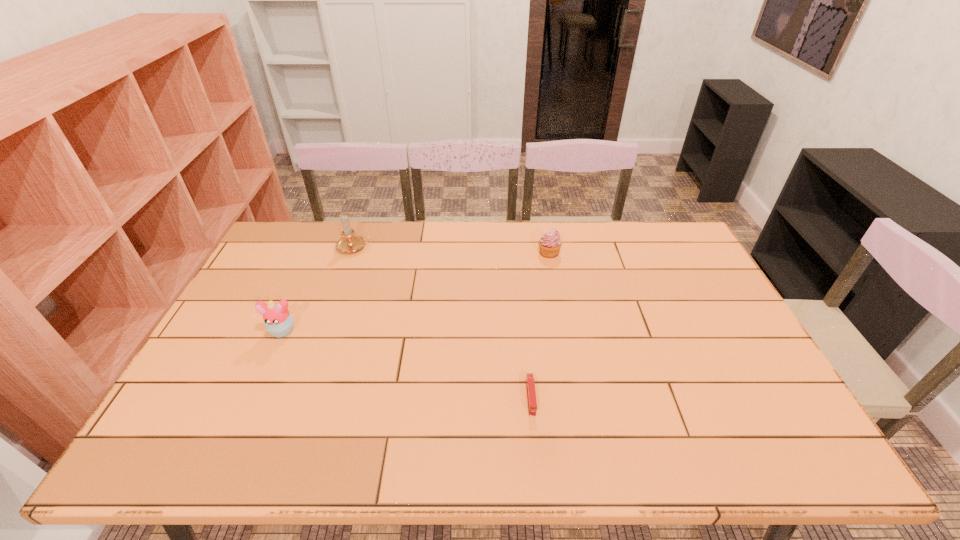
The width and height of the screenshot is (960, 540). Identify the location of vacant space located 0.070m on the front-facing side of the stapler. (536, 444).

Identify the location of candle that is positioned at the far edge. (349, 242).

This screenshot has height=540, width=960. In order to click on cupcake situated at the far edge in this screenshot , I will do `click(550, 243)`.

The width and height of the screenshot is (960, 540). In order to click on object situated at the left edge in this screenshot , I will do `click(279, 322)`.

Identify the location of vacant space at the far edge of the desktop. (494, 228).

The height and width of the screenshot is (540, 960). In the image, there is a desktop. What are the coordinates of `free space at the near edge` in the screenshot? It's located at (368, 442).

The image size is (960, 540). Find the location of `free space at the left edge of the desktop`. free space at the left edge of the desktop is located at coordinates (182, 418).

Image resolution: width=960 pixels, height=540 pixels. I want to click on free space at the near left corner of the desktop, so click(186, 455).

Where is `vacant space at the near right corner of the desktop`? vacant space at the near right corner of the desktop is located at coordinates (760, 457).

Where is `unoccupied area between the second object from left to right and the right cupcake`? This screenshot has height=540, width=960. unoccupied area between the second object from left to right and the right cupcake is located at coordinates (452, 250).